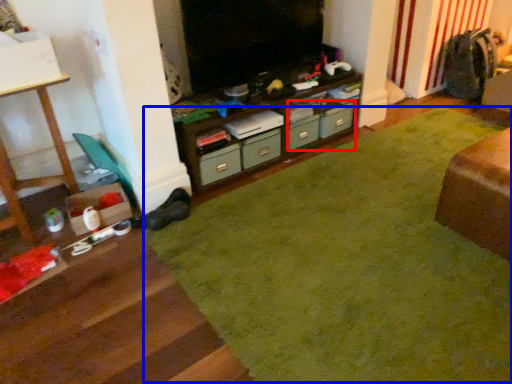
Question: Among these objects, which one is nearest to the camera, drawer (highlighted by a red box) or plain (highlighted by a blue box)?

Choices:
 (A) drawer
 (B) plain

Answer: (B)